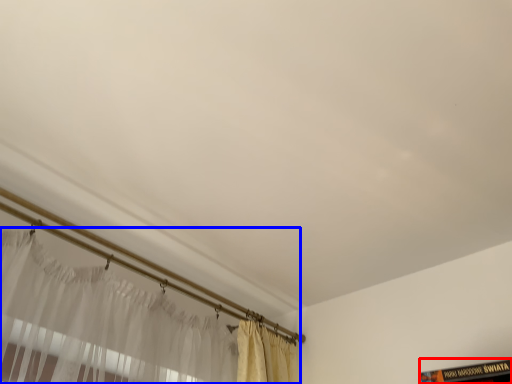
Question: Which point is further to the camera, book (highlighted by a red box) or curtain (highlighted by a blue box)?

Choices:
 (A) book
 (B) curtain

Answer: (B)